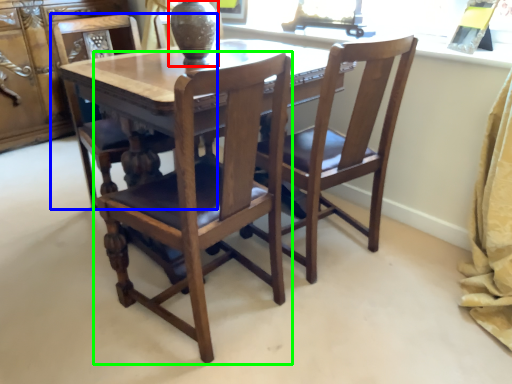
Question: Estimate the real-world distances between objects in this image. Which object is farther from glass vase (highlighted by a red box), chair (highlighted by a blue box) or chair (highlighted by a green box)?

Choices:
 (A) chair
 (B) chair

Answer: (B)